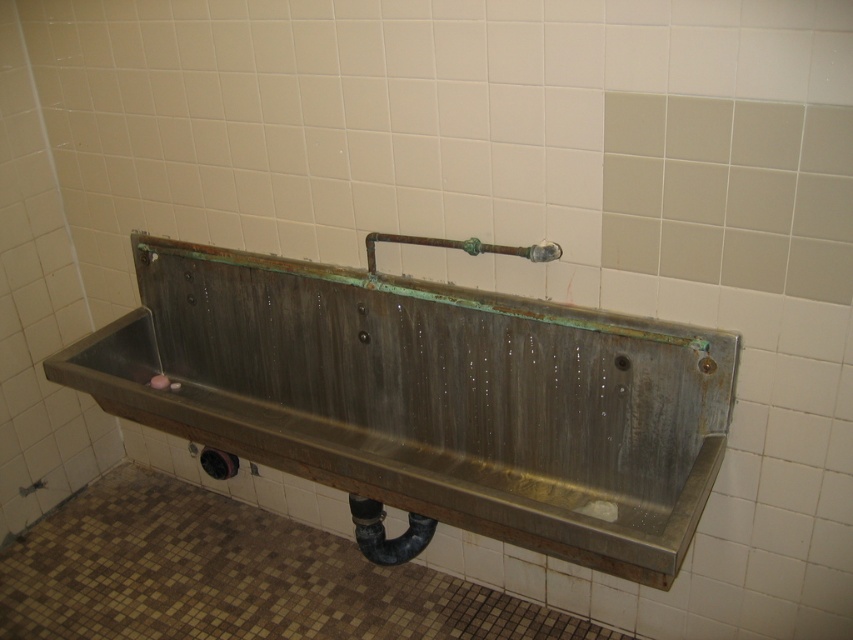
Question: Does stainless steel sink at center have a lesser width compared to green patina faucet at center?

Choices:
 (A) no
 (B) yes

Answer: (A)

Question: Is stainless steel sink at center closer to the viewer compared to green patina faucet at center?

Choices:
 (A) yes
 (B) no

Answer: (A)

Question: Can you confirm if stainless steel sink at center is positioned above green patina faucet at center?

Choices:
 (A) no
 (B) yes

Answer: (A)

Question: Which point is farther to the camera?

Choices:
 (A) green patina faucet at center
 (B) stainless steel sink at center

Answer: (A)